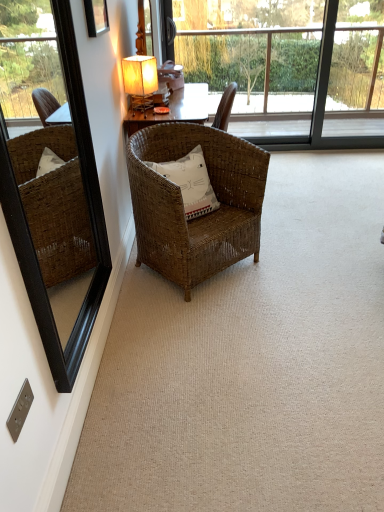
Locate an element on the screen. The image size is (384, 512). free spot in front of woven brown chair at center is located at coordinates (212, 320).